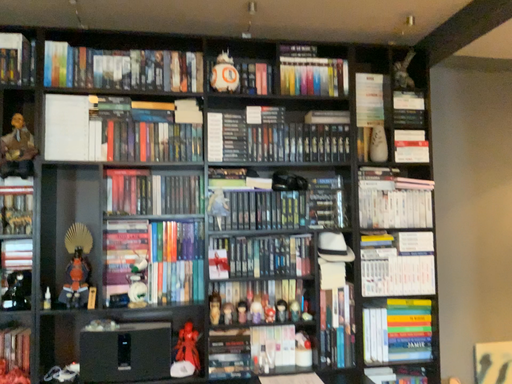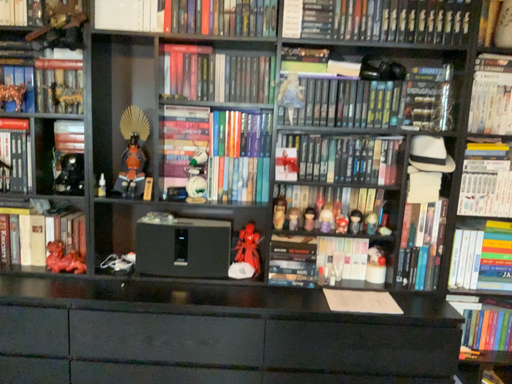
Question: How did the camera likely rotate when shooting the video?

Choices:
 (A) rotated right
 (B) rotated left

Answer: (B)